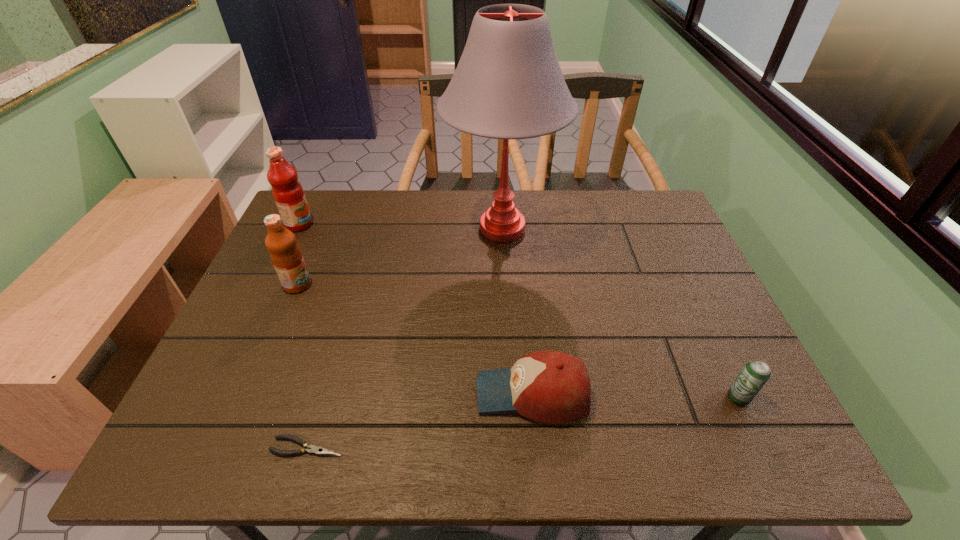
Locate an element on the screen. This screenshot has width=960, height=540. object positioned at the right edge is located at coordinates (754, 375).

Find the location of `object that is at the far left corner`. object that is at the far left corner is located at coordinates (287, 191).

Image resolution: width=960 pixels, height=540 pixels. What are the coordinates of `free space at the far edge of the desktop` in the screenshot? It's located at (480, 197).

The width and height of the screenshot is (960, 540). In the image, there is a desktop. Identify the location of blank space at the near edge. (599, 430).

Where is `vacant space at the left edge`? This screenshot has width=960, height=540. vacant space at the left edge is located at coordinates (252, 285).

The image size is (960, 540). In order to click on vacant space at the right edge in this screenshot , I will do point(655,259).

You are a GUI agent. You are given a task and a screenshot of the screen. Output one action in this format:
    pyautogui.click(x=<x>, y=<y>)
    Task: Click on the vacant space at the far right corner of the desktop
    This screenshot has height=540, width=960.
    Given the screenshot: What is the action you would take?
    pyautogui.click(x=649, y=200)

Where is `vacant space that is in between the third object from left to right and the table lamp`? The image size is (960, 540). vacant space that is in between the third object from left to right and the table lamp is located at coordinates (404, 338).

Where is `free spot between the shorter fruit juice and the rightmost object`? free spot between the shorter fruit juice and the rightmost object is located at coordinates (517, 341).

Find the location of a particular element. free point between the baseball cap and the third object from left to right is located at coordinates (x=420, y=420).